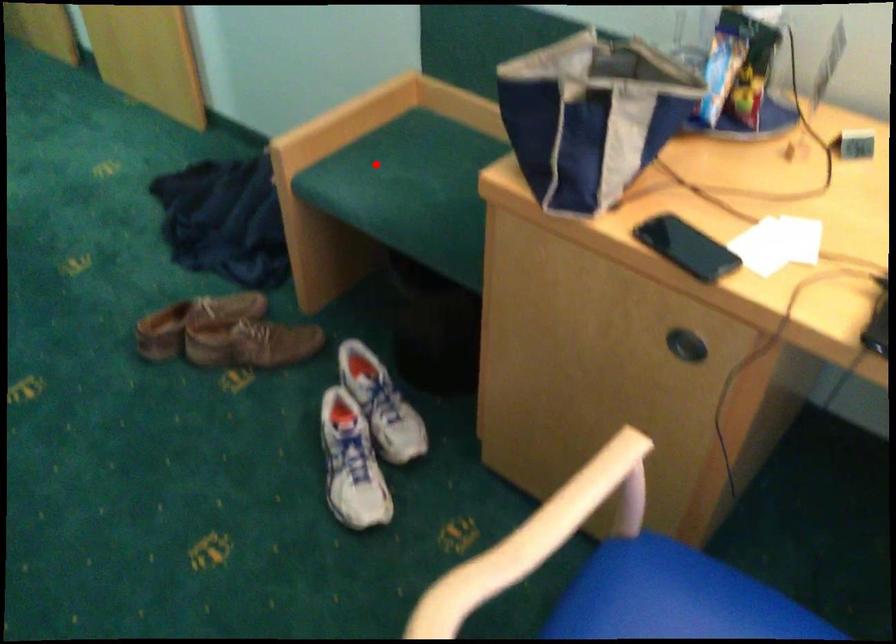
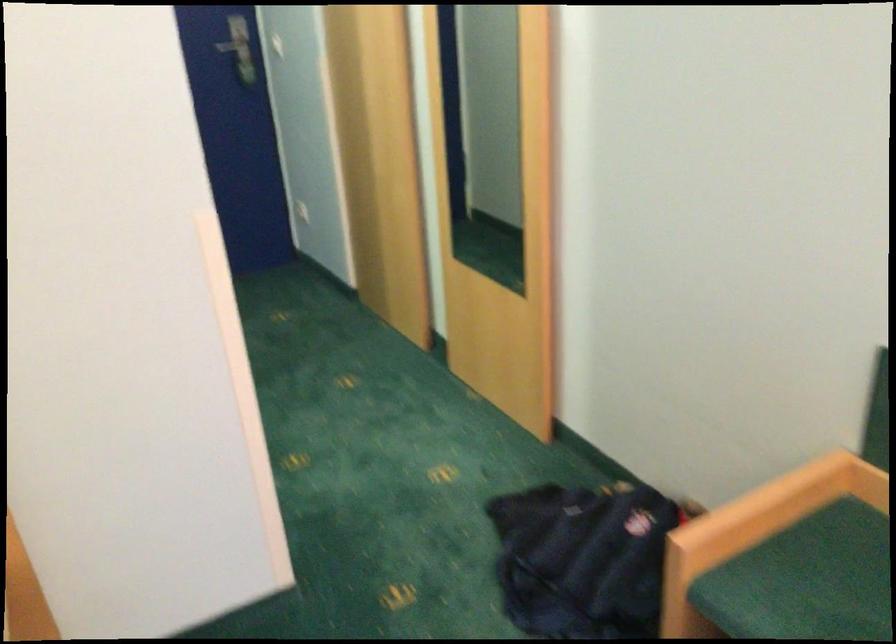
Question: I am providing you with two images of the same scene from different viewpoints. Image1 has a red point marked. In image2, the corresponding 3D location appears at what relative position? Reply with the corresponding letter.

Choices:
 (A) Closer
 (B) Farther

Answer: (A)